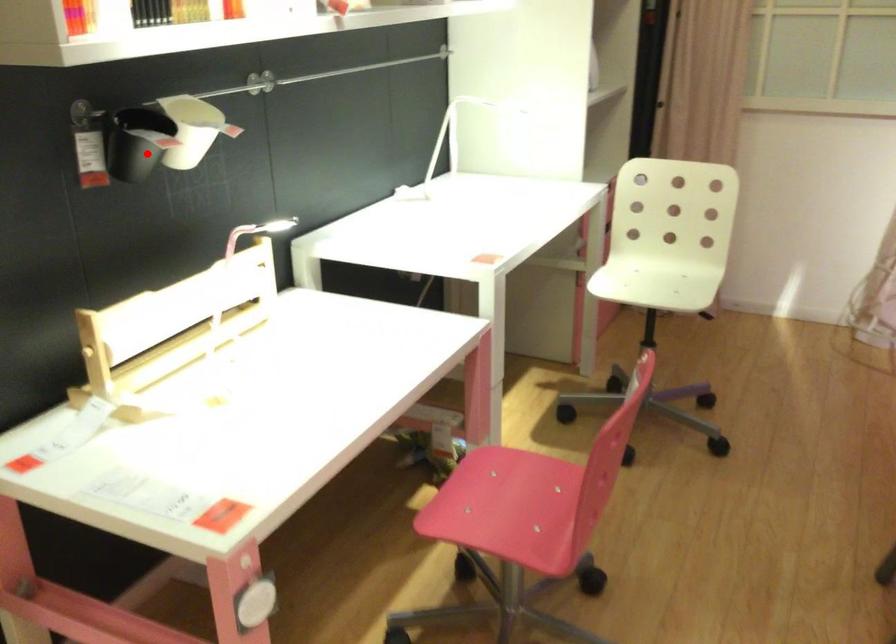
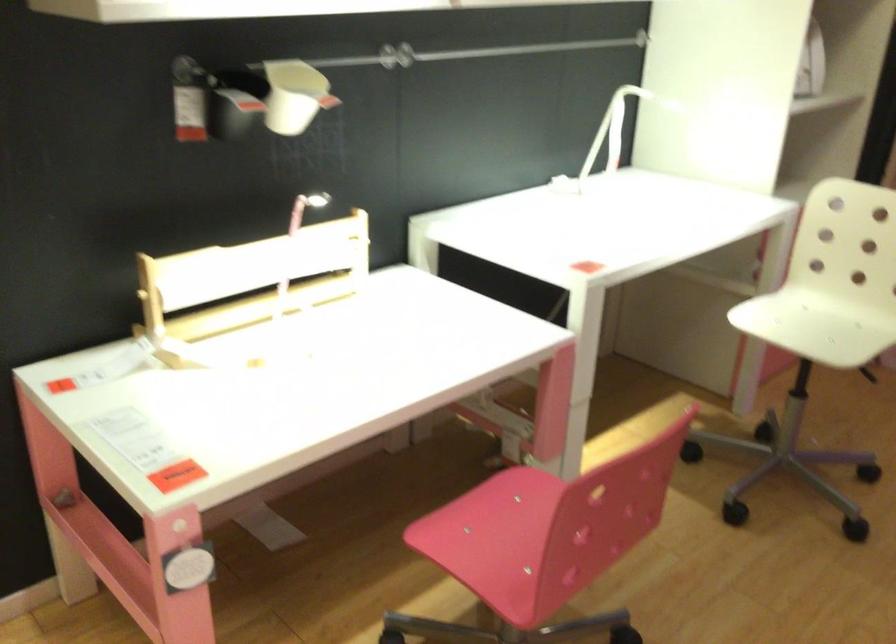
Locate, in the second image, the point that corresponds to the highlighted location in the first image.

(227, 114)